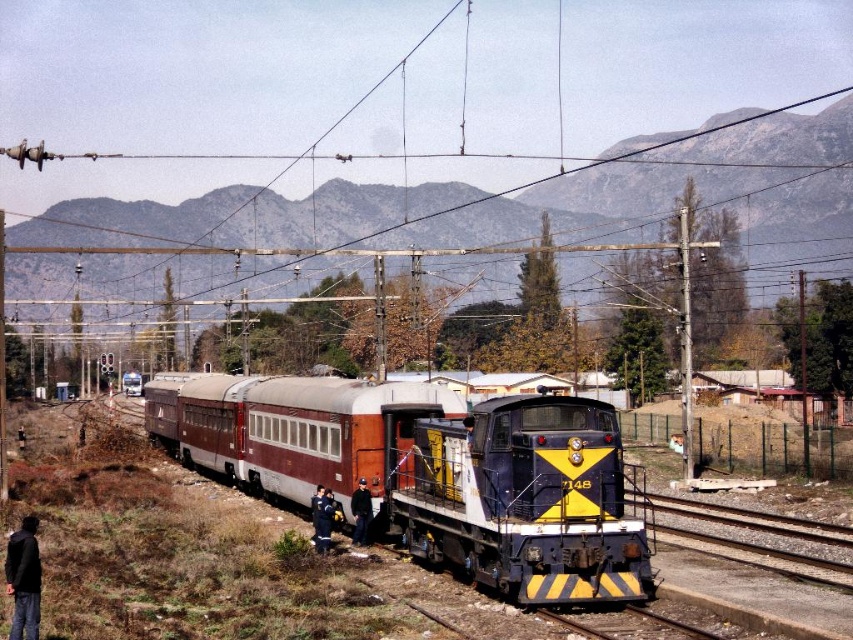
Can you confirm if maroon painted car at center is positioned to the right of black fabric jacket at center?

No, maroon painted car at center is not to the right of black fabric jacket at center.

Describe the element at coordinates (430, 472) in the screenshot. I see `maroon painted car at center` at that location.

What are the coordinates of `maroon painted car at center` in the screenshot? It's located at (430, 472).

Can you confirm if yellow and blue locomotive at center is shorter than black fabric jacket at lower left?

Yes.

How distant is yellow and blue locomotive at center from black fabric jacket at lower left?

7.05 meters

Where is `yellow and blue locomotive at center`? yellow and blue locomotive at center is located at coordinates (519, 497).

The width and height of the screenshot is (853, 640). In order to click on gray gravel train track at lower center in this screenshot , I will do click(x=757, y=536).

Is gray gravel train track at lower center shorter than blue uniform at center?

Incorrect, gray gravel train track at lower center's height does not fall short of blue uniform at center's.

Where is `gray gravel train track at lower center`? The image size is (853, 640). gray gravel train track at lower center is located at coordinates (757, 536).

Where is `gray gravel train track at lower center`? The image size is (853, 640). gray gravel train track at lower center is located at coordinates (757, 536).